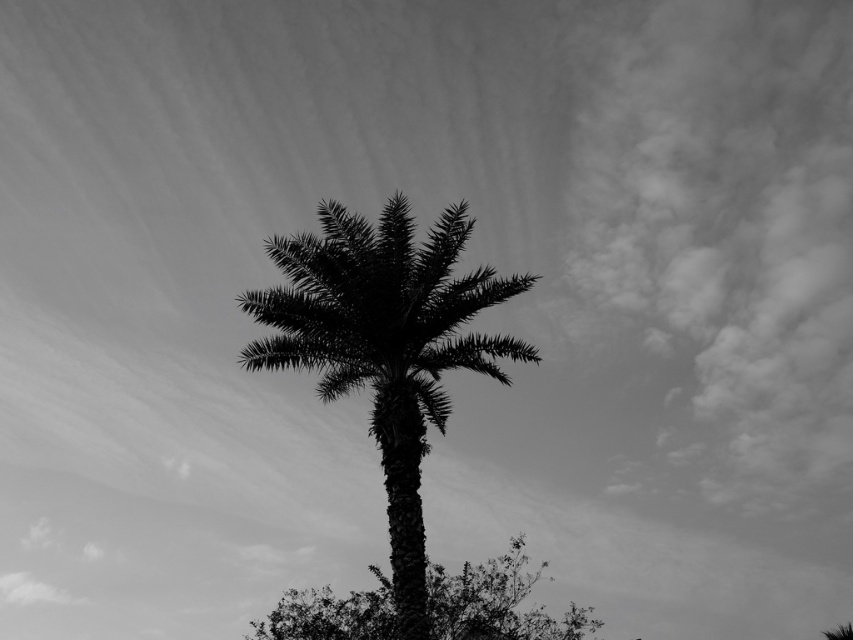
You are a bird flying between two trees in the image. The first is the silhouette leafy palm at center, and the second is the silhouette leafy tree at center. Which tree is closer to you when you are hovering exactly halfway between them?

When hovering exactly halfway between the silhouette leafy palm at center and the silhouette leafy tree at center, both trees are equidistant from you since the distance between them is 18.93 feet, so halfway would mean each is 9.465 feet away.

You are a photographer adjusting your camera settings to focus on two points in the image. The first point is at coordinates point (x=407, y=611) and the second is at point (x=329, y=624). Which point should you focus on first if you want to ensure both are in focus, considering their depth?

Point (x=407, y=611) is closer to the camera than point (x=329, y=624). To ensure both are in focus, focus on the closer point first, which is point (x=407, y=611).